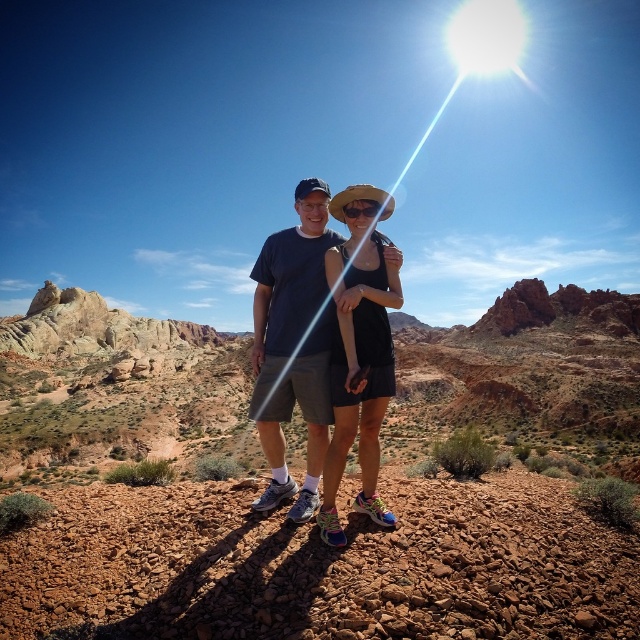
Question: Is dark blue t-shirt at center bigger than matte black tank top at center?

Choices:
 (A) yes
 (B) no

Answer: (A)

Question: Does dark blue t-shirt at center appear on the left side of matte black tank top at center?

Choices:
 (A) no
 (B) yes

Answer: (B)

Question: Does dark blue t-shirt at center appear on the right side of matte black tank top at center?

Choices:
 (A) yes
 (B) no

Answer: (B)

Question: Which of the following is the farthest from the observer?

Choices:
 (A) dark blue t-shirt at center
 (B) matte black tank top at center

Answer: (A)